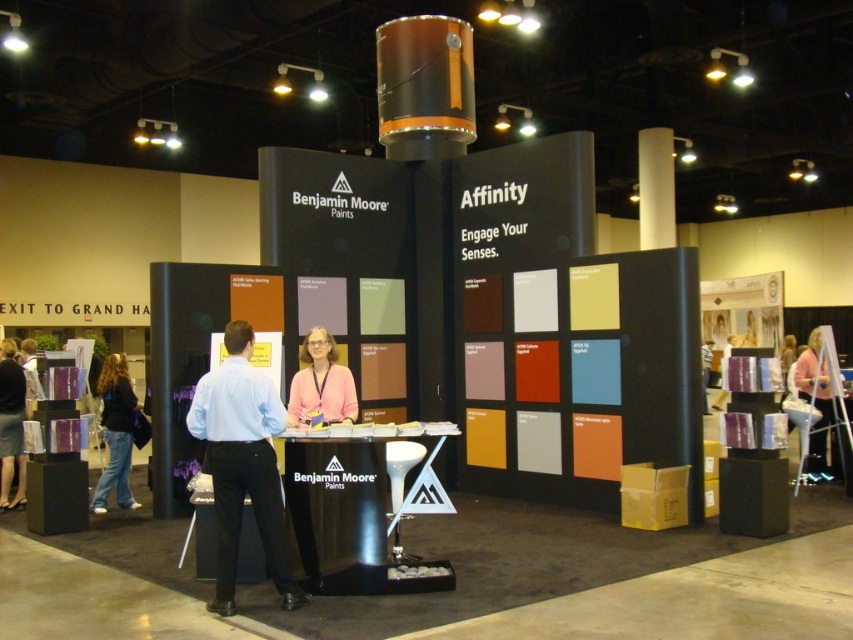
Question: Is light blue shirt at center to the right of denim jeans at lower left from the viewer's perspective?

Choices:
 (A) no
 (B) yes

Answer: (B)

Question: Is light blue shirt at center closer to the viewer compared to pink fabric at center?

Choices:
 (A) no
 (B) yes

Answer: (B)

Question: Does pink fabric at right appear over pink fabric at center?

Choices:
 (A) no
 (B) yes

Answer: (A)

Question: Which of the following is the closest to the observer?

Choices:
 (A) light blue shirt at center
 (B) pink fabric at center
 (C) pink fabric at right
 (D) denim jeans at lower left

Answer: (A)

Question: Which is nearer to the pink fabric at right?

Choices:
 (A) light blue shirt at center
 (B) pink fabric at center
 (C) denim jeans at lower left

Answer: (B)

Question: Which of the following is the closest to the observer?

Choices:
 (A) (115, 396)
 (B) (264, 454)
 (C) (811, 461)
 (D) (300, 381)

Answer: (B)